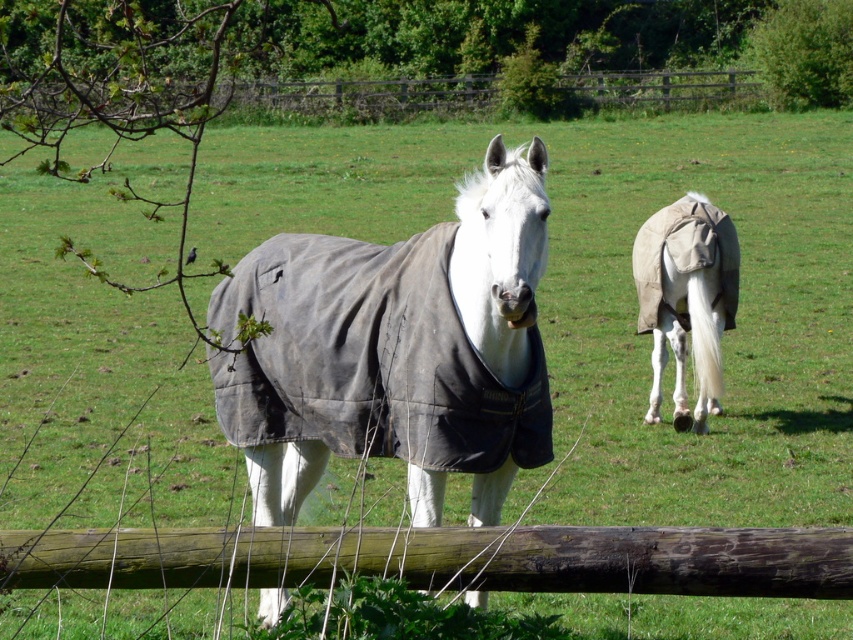
The height and width of the screenshot is (640, 853). What are the coordinates of `wooden fence at upper center` in the screenshot? It's located at (358, 99).

Describe the element at coordinates (358, 99) in the screenshot. This screenshot has width=853, height=640. I see `wooden fence at upper center` at that location.

Which is in front, point (329, 106) or point (679, 324)?

Positioned in front is point (679, 324).

This screenshot has width=853, height=640. Identify the location of wooden fence at upper center. (358, 99).

Which of these two, white clothed horse at center or wooden fence at upper center, stands taller?

With more height is wooden fence at upper center.

Between point (509, 355) and point (701, 99), which one is positioned in front?

Point (509, 355)

Identify the location of white clothed horse at center. The image size is (853, 640). (396, 349).

Is white clothed horse at center taller than white cloth-covered horse at center?

Indeed, white clothed horse at center has a greater height compared to white cloth-covered horse at center.

Which of these two, white clothed horse at center or white cloth-covered horse at center, stands shorter?

white cloth-covered horse at center

Who is more distant from viewer, (282, 502) or (697, 372)?

Point (697, 372)

Find the location of a particular element. This screenshot has width=853, height=640. white clothed horse at center is located at coordinates (396, 349).